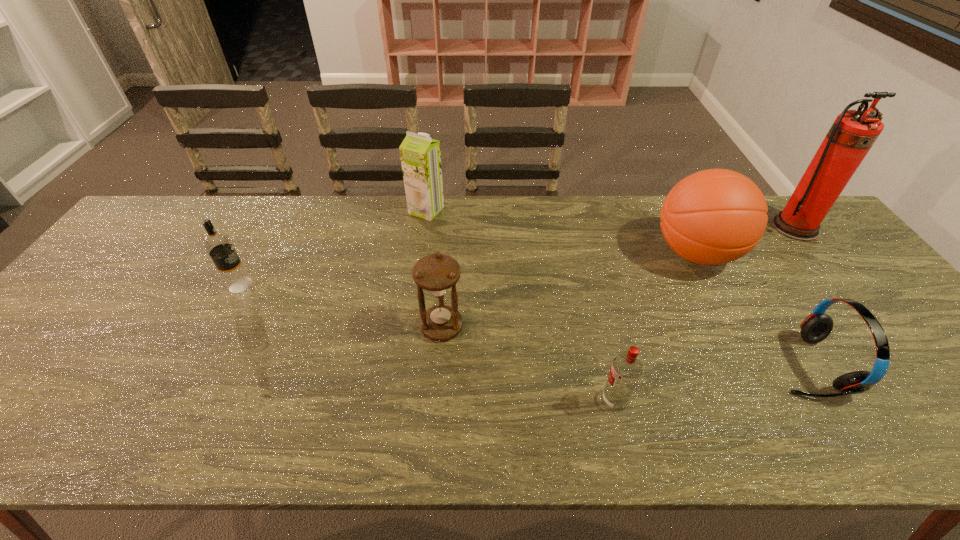
At what (x,y) coordinates should I click in order to perform the action: click on vacant region located with the microphone attached to the side of the headset. Please return your answer as a coordinate pair (x, y). Looking at the image, I should click on (709, 365).

Find the location of a particular element. The image size is (960, 540). fire extinguisher that is positioned at the far edge is located at coordinates (853, 133).

Image resolution: width=960 pixels, height=540 pixels. What are the coordinates of `soya milk that is at the far edge` in the screenshot? It's located at (420, 155).

The height and width of the screenshot is (540, 960). Find the location of `basketball at the far edge`. basketball at the far edge is located at coordinates (715, 216).

Find the location of a particular element. object located at the near edge is located at coordinates (626, 369).

Find the location of a particular element. object present at the right edge is located at coordinates (853, 133).

Image resolution: width=960 pixels, height=540 pixels. What are the coordinates of `object present at the far right corner` in the screenshot? It's located at (853, 133).

The width and height of the screenshot is (960, 540). I want to click on free location at the far edge of the desktop, so click(662, 204).

Find the location of a particular element. Image resolution: width=960 pixels, height=540 pixels. vacant position at the near edge of the desktop is located at coordinates (60, 426).

Locate an element on the screen. The width and height of the screenshot is (960, 540). vacant position at the left edge of the desktop is located at coordinates (124, 271).